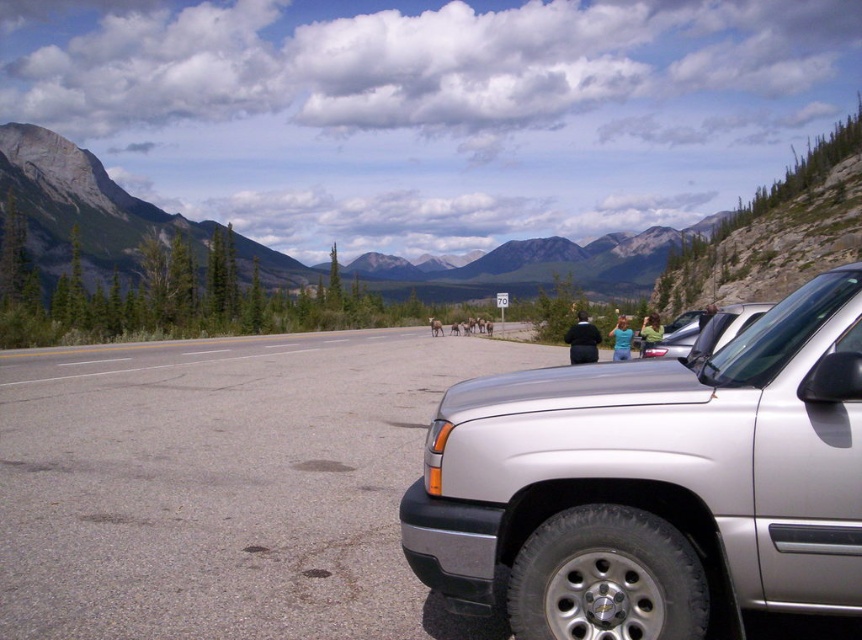
Question: Which of the following is the closest to the observer?

Choices:
 (A) black matte jacket at center
 (B) satin silver suv at right
 (C) green fabric jacket at center

Answer: (B)

Question: Can you confirm if blue cotton shirt at center is positioned below black plastic license plate at center?

Choices:
 (A) yes
 (B) no

Answer: (B)

Question: Which point is farther from the camera taking this photo?

Choices:
 (A) (759, 304)
 (B) (654, 339)

Answer: (B)

Question: Is gray rock mountain at upper left closer to the viewer compared to black plastic license plate at center?

Choices:
 (A) no
 (B) yes

Answer: (A)

Question: Which point appears farthest from the camera in this image?

Choices:
 (A) (644, 344)
 (B) (185, 397)
 (C) (73, 172)
 (D) (613, 356)

Answer: (C)

Question: Is blue cotton shirt at center bigger than green fabric jacket at center?

Choices:
 (A) no
 (B) yes

Answer: (B)